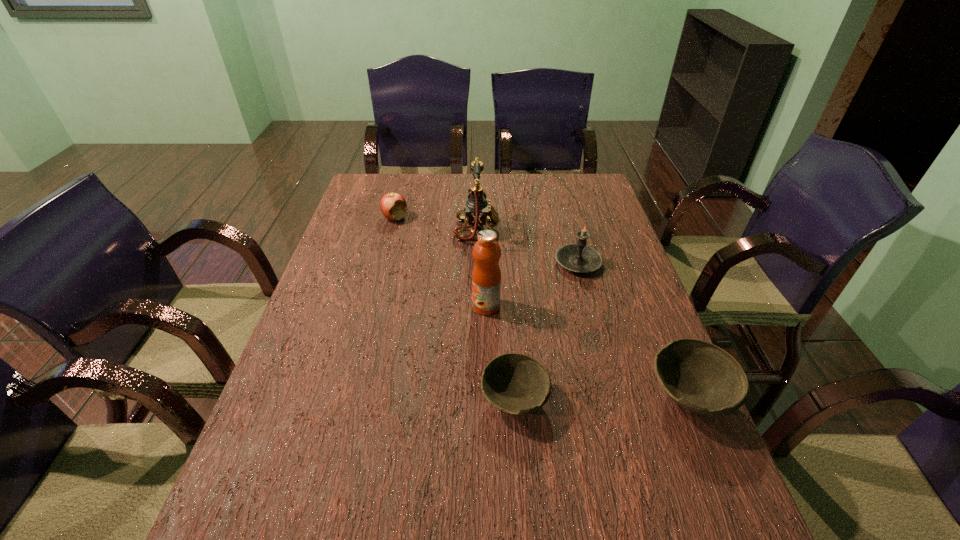
Observe the arrangement of all bowls in the image. To keep them evenly spaced, where would you place another bowl on the left? Please locate a free space. Please provide its 2D coordinates. Your answer should be formatted as a tuple, i.e. [(x, y)], where the tuple contains the x and y coordinates of a point satisfying the conditions above.

[(337, 403)]